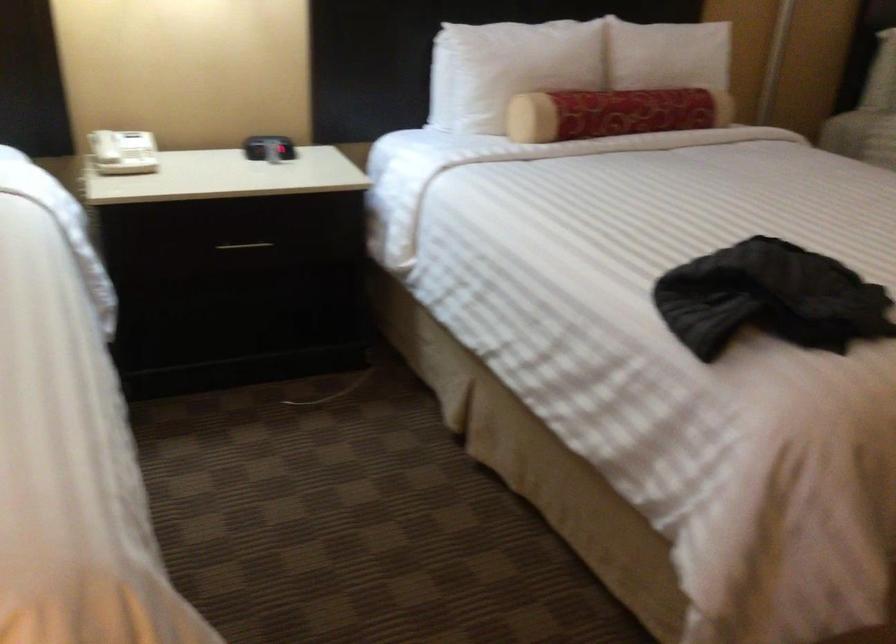
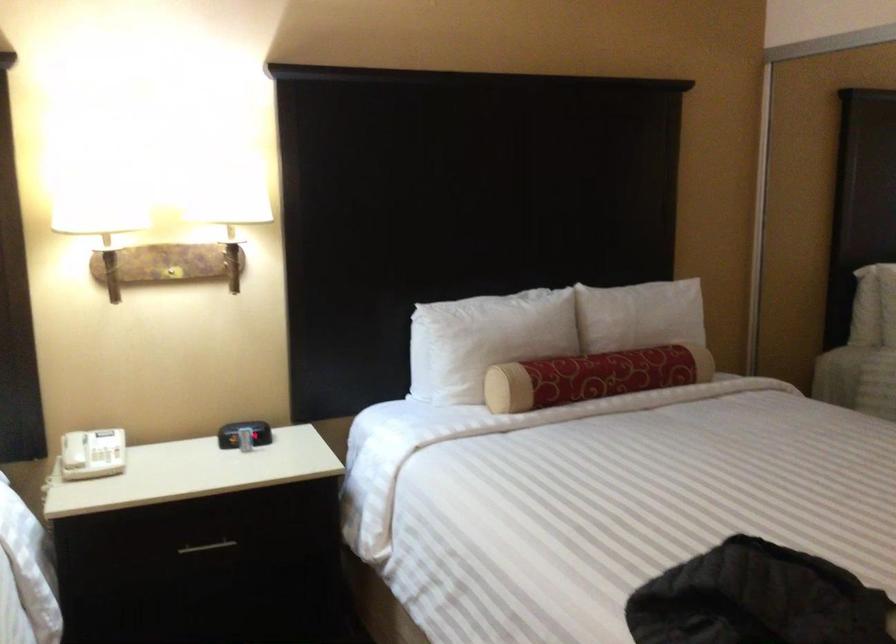
Question: The first image is from the beginning of the video and the second image is from the end. How did the camera likely rotate when shooting the video?

Choices:
 (A) Left
 (B) Right
 (C) Up
 (D) Down

Answer: (C)